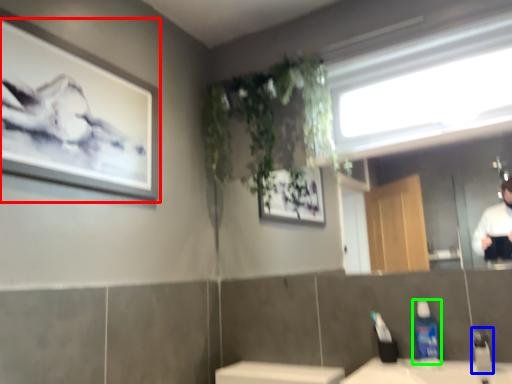
Question: Estimate the real-world distances between objects in this image. Which object is closer to picture frame (highlighted by a red box), faucet (highlighted by a blue box) or cleaning product (highlighted by a green box)?

Choices:
 (A) faucet
 (B) cleaning product

Answer: (B)